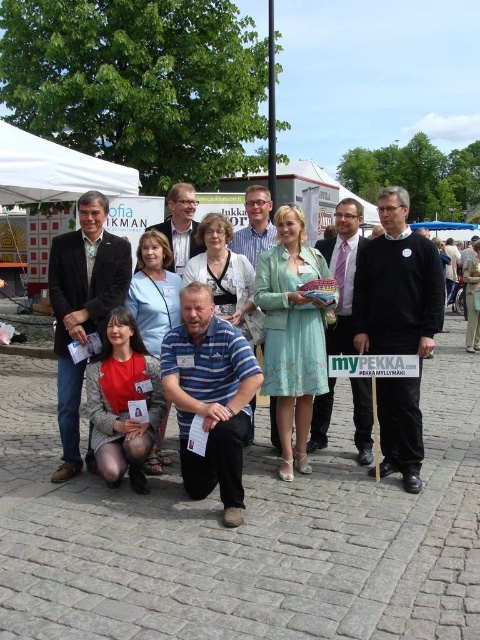
In the scene shown: Which of these two, light blue fabric dress at center or white fabric canopy at upper left, stands shorter?

white fabric canopy at upper left

The width and height of the screenshot is (480, 640). Describe the element at coordinates (395, 326) in the screenshot. I see `light blue fabric dress at center` at that location.

Locate an element on the screen. This screenshot has width=480, height=640. light blue fabric dress at center is located at coordinates (395, 326).

What do you see at coordinates (55, 170) in the screenshot? This screenshot has height=640, width=480. I see `white fabric canopy at upper left` at bounding box center [55, 170].

Which is in front, point (61, 161) or point (305, 166)?

Point (61, 161)

This screenshot has height=640, width=480. What are the coordinates of `white fabric canopy at upper left` in the screenshot? It's located at (55, 170).

Is point (316, 172) positioned behind point (421, 225)?

No, it is in front of (421, 225).

Can you confirm if white fabric canopy at upper center is smaller than blue fabric canopy at upper center?

No, white fabric canopy at upper center is not smaller than blue fabric canopy at upper center.

Describe the element at coordinates (324, 182) in the screenshot. I see `white fabric canopy at upper center` at that location.

Find the location of a particular element. This screenshot has height=640, width=480. white fabric canopy at upper center is located at coordinates (324, 182).